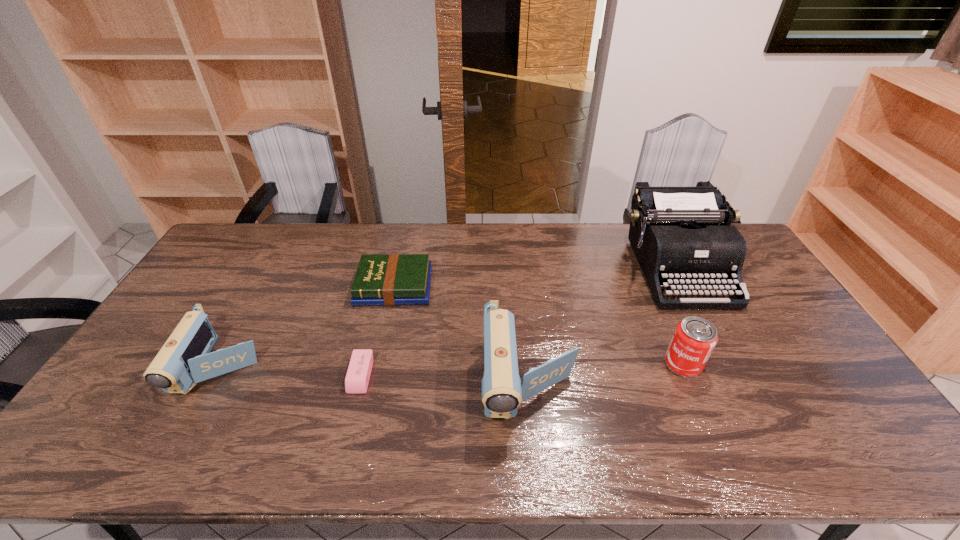
All camcorders are currently evenly spaced. To continue this pattern, where would you add another camcorder on the right? Please point out a vacant spot. Please provide its 2D coordinates. Your answer should be formatted as a tuple, i.e. [(x, y)], where the tuple contains the x and y coordinates of a point satisfying the conditions above.

[(856, 400)]